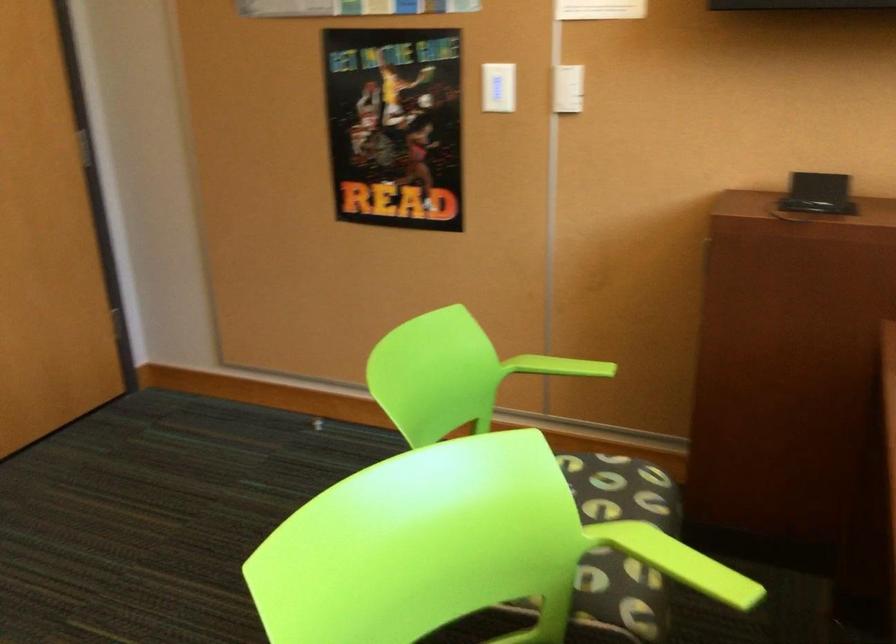
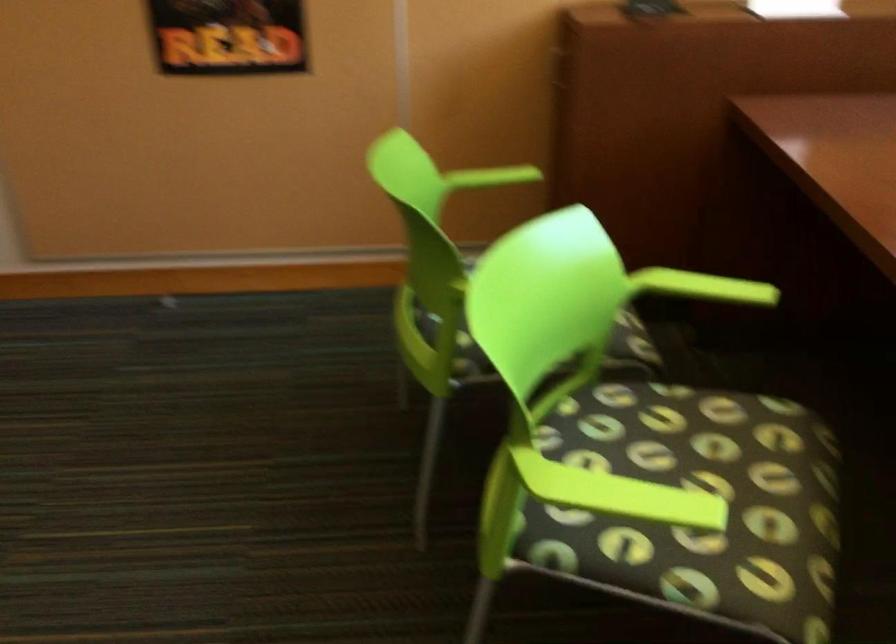
The point at (570, 366) is marked in the first image. Where is the corresponding point in the second image?

(497, 176)